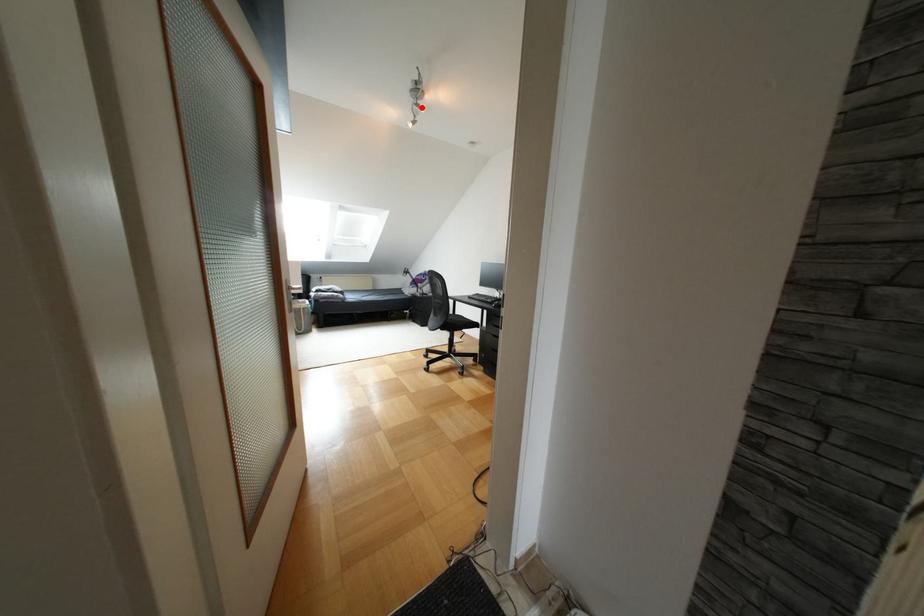
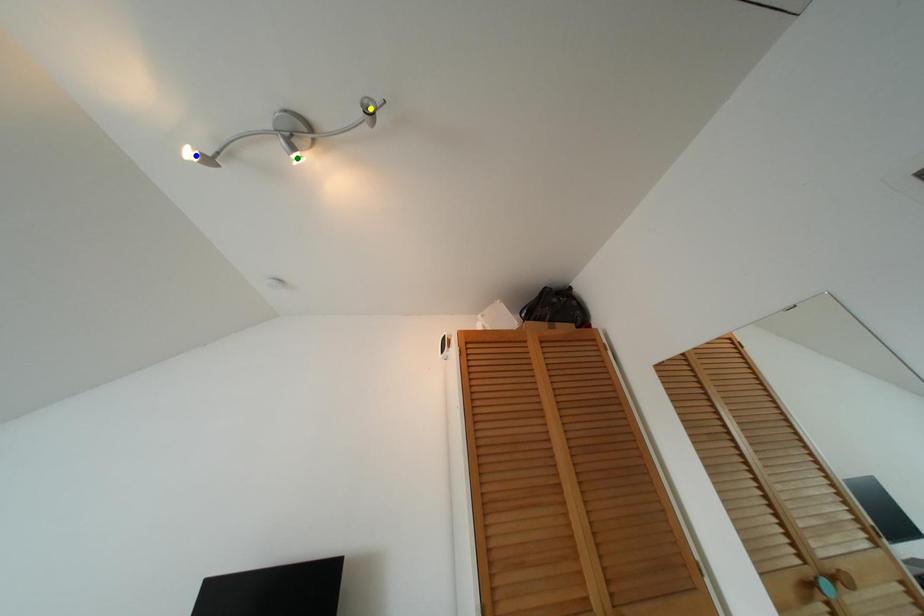
Question: I am providing you with two images of the same scene from different viewpoints. A red point is marked on the first image. You are given multiple points on the second image. Which spot in image 2 lines up with the point in image 1?

Choices:
 (A) blue point
 (B) green point
 (C) yellow point

Answer: (B)